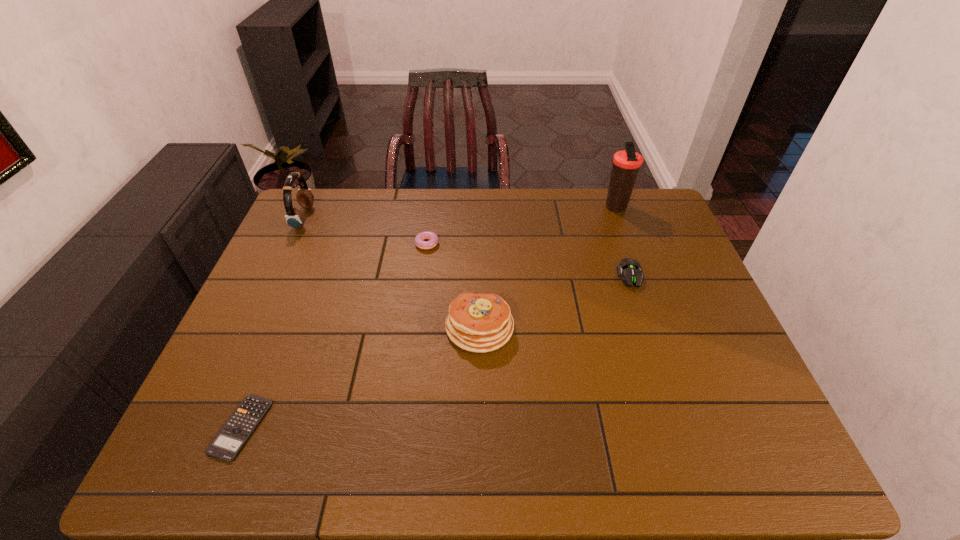
Locate an element on the screen. the third closest object to the headset is located at coordinates (227, 444).

Image resolution: width=960 pixels, height=540 pixels. Find the location of `vacant point that satisfies the following two spatial constraints: 1. on the ear cup of the shortest object; 2. on the left side of the fifth shortest object`. vacant point that satisfies the following two spatial constraints: 1. on the ear cup of the shortest object; 2. on the left side of the fifth shortest object is located at coordinates (207, 427).

Where is `vacant space that satisfies the following two spatial constraints: 1. on the back side of the thermos bottle; 2. on the left side of the third farthest object`? vacant space that satisfies the following two spatial constraints: 1. on the back side of the thermos bottle; 2. on the left side of the third farthest object is located at coordinates (429, 207).

This screenshot has width=960, height=540. Find the location of `free location that satisfies the following two spatial constraints: 1. on the back side of the fourth nearest object; 2. on the left side of the calculator`. free location that satisfies the following two spatial constraints: 1. on the back side of the fourth nearest object; 2. on the left side of the calculator is located at coordinates (315, 244).

Where is `blank space that satisfies the following two spatial constraints: 1. on the back side of the third object from left to right; 2. on the ear cup of the headset`? Image resolution: width=960 pixels, height=540 pixels. blank space that satisfies the following two spatial constraints: 1. on the back side of the third object from left to right; 2. on the ear cup of the headset is located at coordinates (427, 218).

Identify the location of free spot that satisfies the following two spatial constraints: 1. on the ear cup of the fifth shortest object; 2. on the back side of the doughnut. This screenshot has width=960, height=540. coord(292,244).

The image size is (960, 540). I want to click on vacant position in the image that satisfies the following two spatial constraints: 1. on the back side of the nearest object; 2. on the ear cup of the headset, so 325,218.

Where is `vacant region that satisfies the following two spatial constraints: 1. on the back side of the third nearest object; 2. on the ear cup of the headset`? The image size is (960, 540). vacant region that satisfies the following two spatial constraints: 1. on the back side of the third nearest object; 2. on the ear cup of the headset is located at coordinates (611, 218).